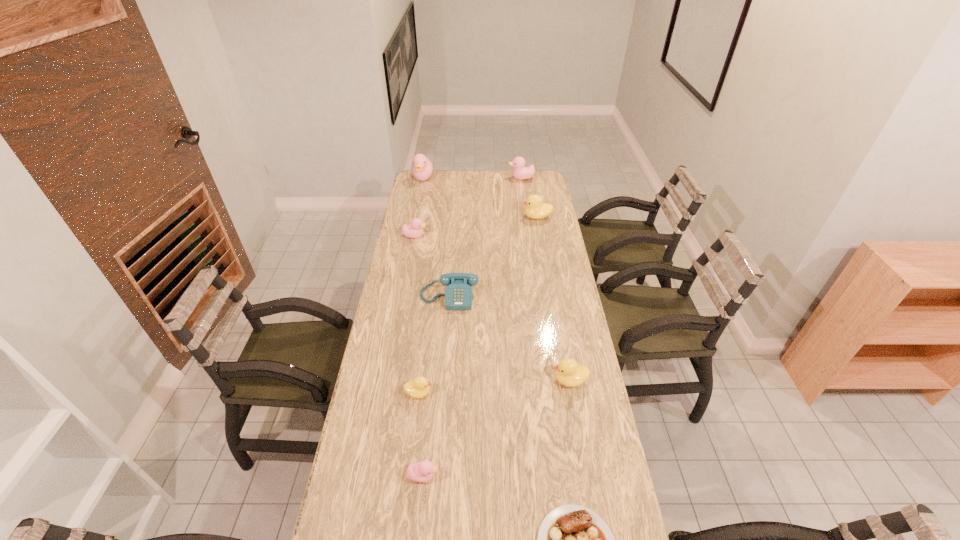
I want to click on the second pink duckling from right to left, so click(421, 472).

Identify the location of the nearest duckling. This screenshot has width=960, height=540. (421, 472).

Find the location of a particular element. The height and width of the screenshot is (540, 960). the smallest yellow duckling is located at coordinates (418, 388).

Where is `free space located on the front-facing side of the biggest pink duckling`? free space located on the front-facing side of the biggest pink duckling is located at coordinates [x=420, y=193].

Find the location of a particular element. The height and width of the screenshot is (540, 960). vacant space located 0.270m on the front-facing side of the third smallest pink duckling is located at coordinates [461, 178].

Image resolution: width=960 pixels, height=540 pixels. In order to click on vacant space positioned 0.160m on the front-facing side of the third smallest pink duckling in this screenshot , I will do `click(480, 178)`.

Image resolution: width=960 pixels, height=540 pixels. Find the location of `vacant space located on the front-facing side of the third smallest pink duckling`. vacant space located on the front-facing side of the third smallest pink duckling is located at coordinates (444, 178).

Find the location of a particular element. free space located on the beak of the farthest yellow duckling is located at coordinates (465, 217).

This screenshot has width=960, height=540. Identify the location of free location located 0.210m on the beak of the farthest yellow duckling. (480, 217).

Where is `vacant space located 0.240m on the beak of the farthest yellow duckling`? This screenshot has width=960, height=540. vacant space located 0.240m on the beak of the farthest yellow duckling is located at coordinates (474, 217).